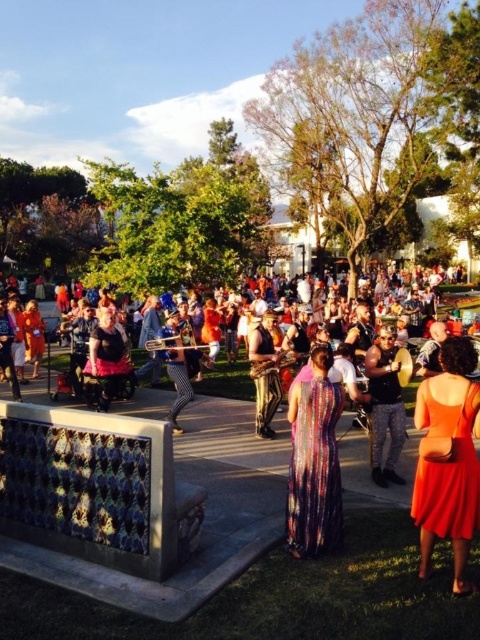
You are a photographer at the festival and want to capture both the orange satin dress at center and the multicolored sequined dress at center in a single photo. Which dress should you position closer to the camera to ensure both are fully visible in the frame?

The orange satin dress at center is taller than the multicolored sequined dress at center. To ensure both are fully visible, position the orange satin dress at center closer to the camera so its full height can be captured without cropping.

Based on the photo, you are a photographer trying to capture a clear shot of the camouflage pants at center and the shiny gold pants at center. Since you want both to be in focus, which one should you focus on first?

You should focus on the camouflage pants at center first because it is in front of the shiny gold pants at center, so focusing on the closer object will ensure both are in focus.